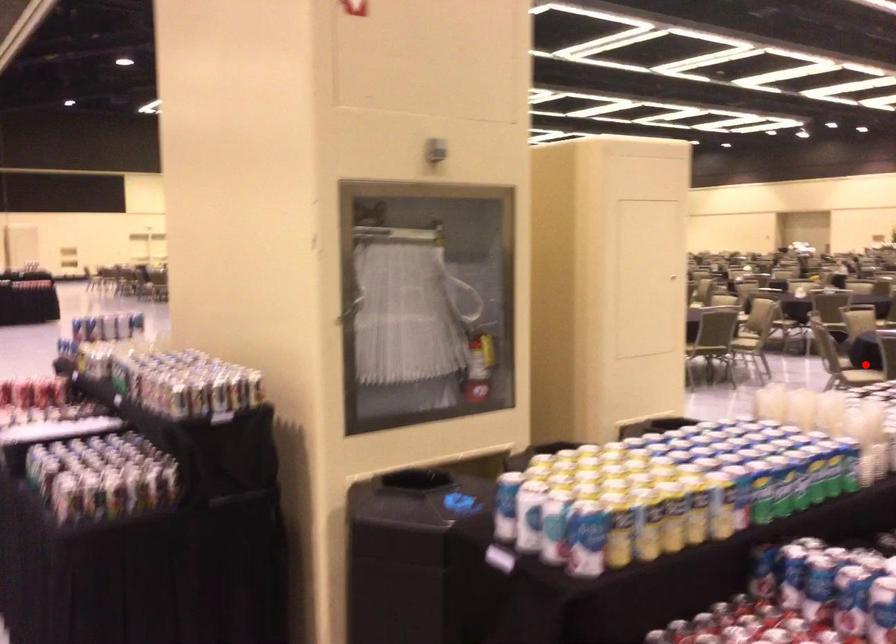
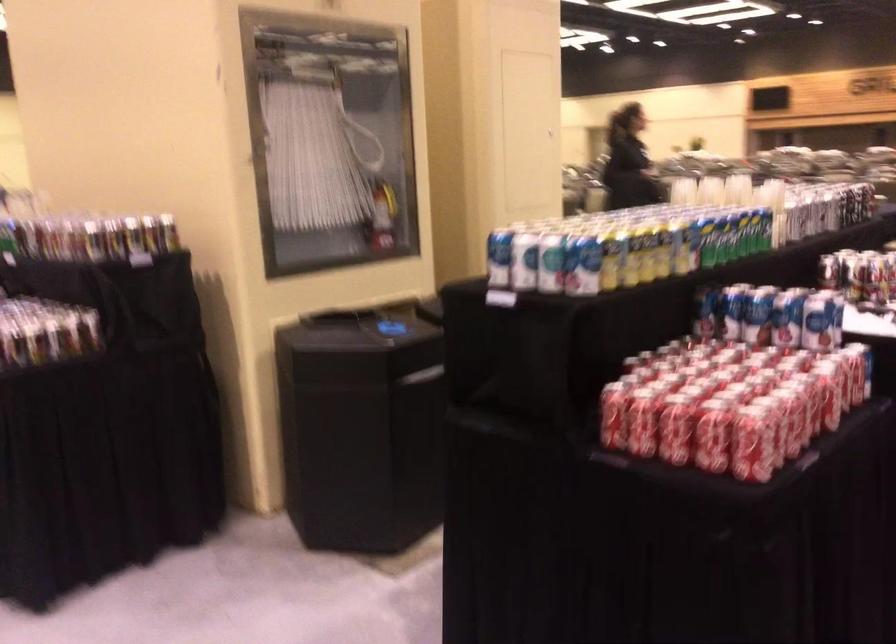
Question: I am providing you with two images of the same scene from different viewpoints. A red point is marked on the first image. Can you still see the location of the red point in image 2?

Choices:
 (A) Yes
 (B) No

Answer: (B)